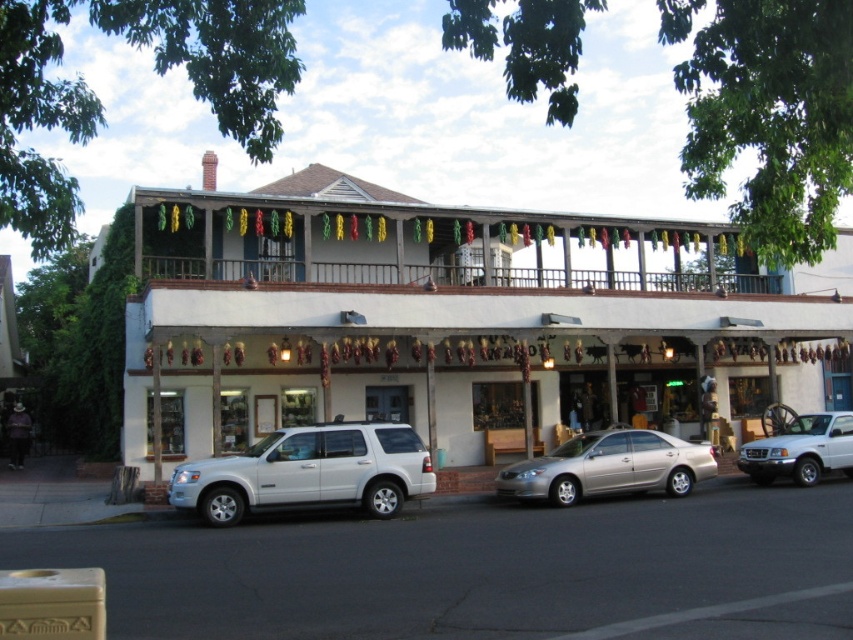
Which is more to the left, white matte building at center or satin gold sedan at center?

Positioned to the left is white matte building at center.

Which of these two, white matte building at center or satin gold sedan at center, stands shorter?

With less height is satin gold sedan at center.

Between point (299, 420) and point (612, 467), which one is positioned behind?

Positioned behind is point (299, 420).

The height and width of the screenshot is (640, 853). Find the location of `white matte building at center`. white matte building at center is located at coordinates (453, 321).

Describe the element at coordinates (308, 472) in the screenshot. This screenshot has height=640, width=853. I see `white matte suv at lower left` at that location.

Which is in front, point (424, 484) or point (613, 435)?

Point (424, 484)

Between point (271, 436) and point (544, 467), which one is positioned behind?

Point (544, 467)

I want to click on white matte suv at lower left, so click(308, 472).

Can you confirm if white matte building at center is thinner than white matte truck at lower right?

→ In fact, white matte building at center might be wider than white matte truck at lower right.

Does white matte building at center have a lesser height compared to white matte truck at lower right?

No, white matte building at center is not shorter than white matte truck at lower right.

The image size is (853, 640). I want to click on white matte building at center, so tap(453, 321).